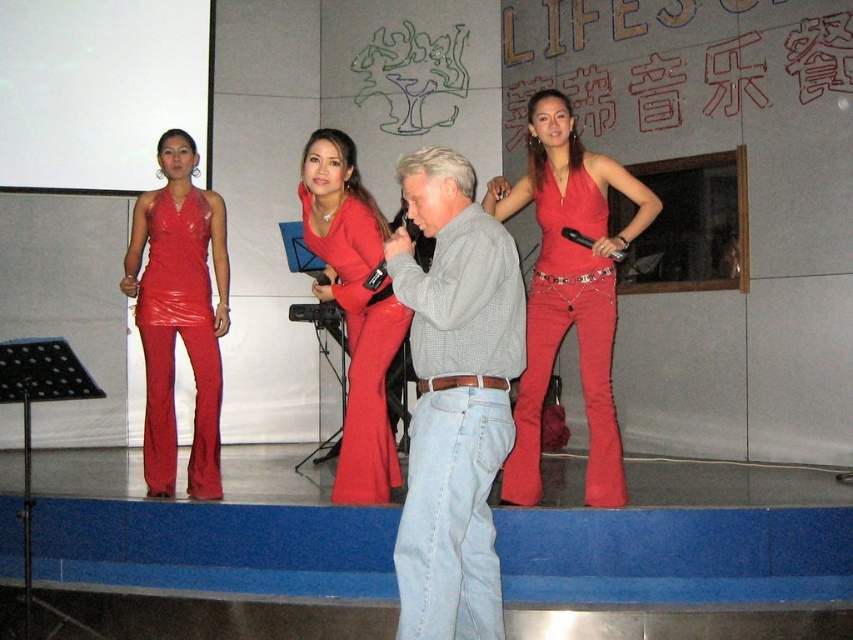
Which is below, gray checkered shirt at center or shiny red dress at left?

gray checkered shirt at center is lower down.

Can you confirm if gray checkered shirt at center is wider than shiny red dress at left?

Yes.

Which is behind, point (447, 272) or point (148, 339)?

The point (148, 339) is behind.

What are the coordinates of `gray checkered shirt at center` in the screenshot? It's located at (454, 397).

Is gray checkered shirt at center further to the viewer compared to shiny red dress at center?

No, it is not.

Which is above, gray checkered shirt at center or shiny red dress at center?

Positioned higher is shiny red dress at center.

Who is more forward, (471, 308) or (566, 218)?

Positioned in front is point (471, 308).

In order to click on gray checkered shirt at center in this screenshot , I will do `click(454, 397)`.

Between light blue fabric stage at center and matte red jumpsuit at center, which one is positioned higher?

matte red jumpsuit at center

Between point (280, 460) and point (335, 492), which one is positioned in front?

Point (335, 492) is in front.

Who is more forward, (129, 500) or (360, 394)?

Point (360, 394)

Locate an element on the screen. light blue fabric stage at center is located at coordinates (686, 557).